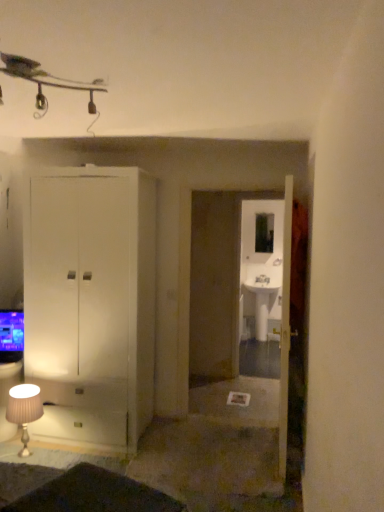
Question: From the image's perspective, would you say white glossy sink at center is positioned over clear glass mirror at center?

Choices:
 (A) no
 (B) yes

Answer: (A)

Question: Is the surface of white glossy sink at center in direct contact with clear glass mirror at center?

Choices:
 (A) no
 (B) yes

Answer: (A)

Question: Does white glossy sink at center have a smaller size compared to clear glass mirror at center?

Choices:
 (A) no
 (B) yes

Answer: (A)

Question: Is white glossy sink at center at the left side of clear glass mirror at center?

Choices:
 (A) yes
 (B) no

Answer: (A)

Question: Is white glossy sink at center at the right side of clear glass mirror at center?

Choices:
 (A) yes
 (B) no

Answer: (B)

Question: Is point (291, 204) closer or farther from the camera than point (21, 420)?

Choices:
 (A) closer
 (B) farther

Answer: (A)

Question: Looking at their shapes, would you say white glossy door at center is wider or thinner than white fabric lampshade at lower left?

Choices:
 (A) thin
 (B) wide

Answer: (A)

Question: From the image's perspective, relative to white fabric lampshade at lower left, is white glossy door at center above or below?

Choices:
 (A) below
 (B) above

Answer: (B)

Question: Visually, is white glossy door at center positioned to the left or to the right of white fabric lampshade at lower left?

Choices:
 (A) left
 (B) right

Answer: (B)

Question: In the image, is transparent glass sink at center on the left side or the right side of white fabric lampshade at lower left?

Choices:
 (A) left
 (B) right

Answer: (B)

Question: From the image's perspective, is transparent glass sink at center located above or below white fabric lampshade at lower left?

Choices:
 (A) below
 (B) above

Answer: (B)

Question: Relative to white fabric lampshade at lower left, is transparent glass sink at center in front or behind?

Choices:
 (A) behind
 (B) front

Answer: (A)

Question: From a real-world perspective, is transparent glass sink at center positioned above or below white fabric lampshade at lower left?

Choices:
 (A) above
 (B) below

Answer: (A)

Question: From the image's perspective, is blue glossy television at lower left above or below clear glass mirror at center?

Choices:
 (A) below
 (B) above

Answer: (A)

Question: Is point (13, 342) positioned closer to the camera than point (264, 230)?

Choices:
 (A) closer
 (B) farther

Answer: (A)